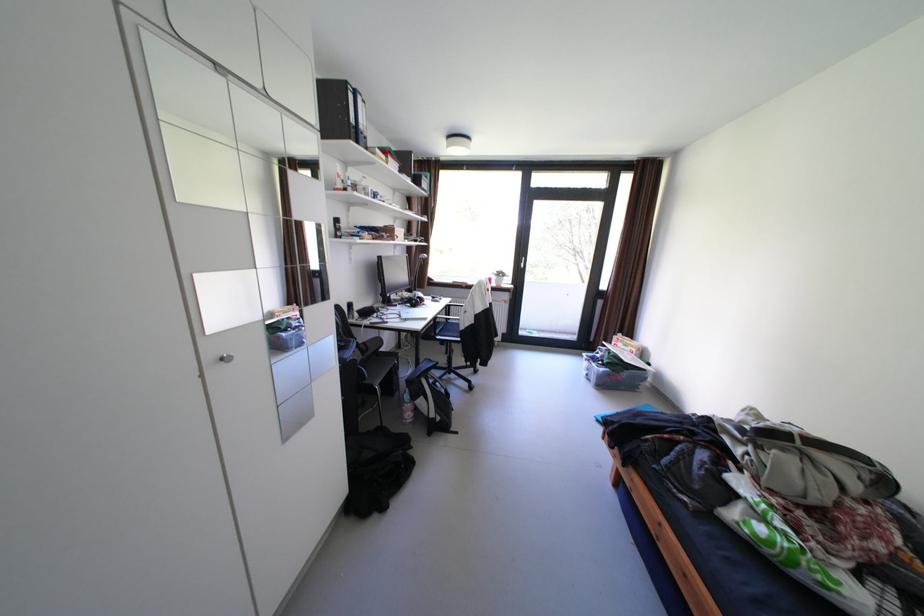
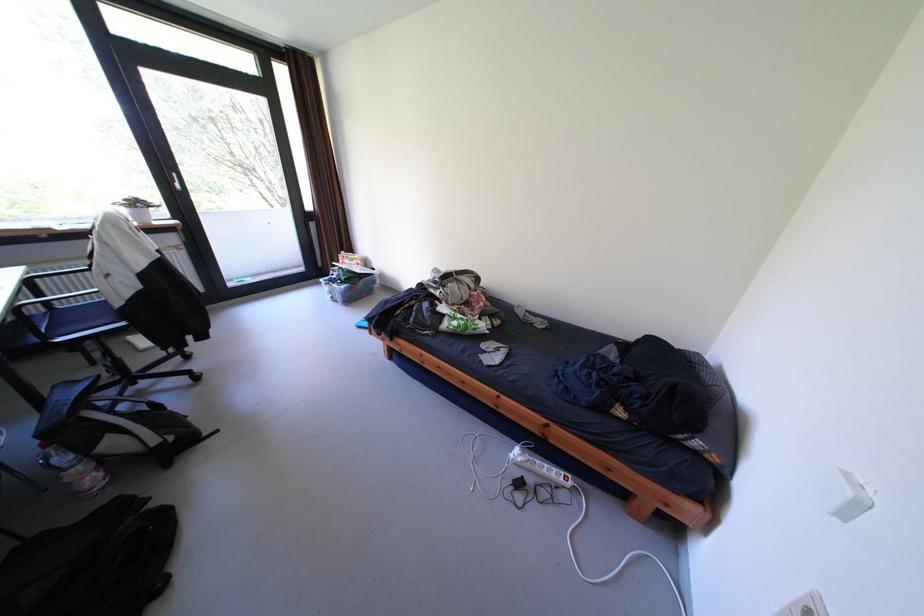
Find the pixel in the second image that matches [417,416] in the first image.

(99, 485)